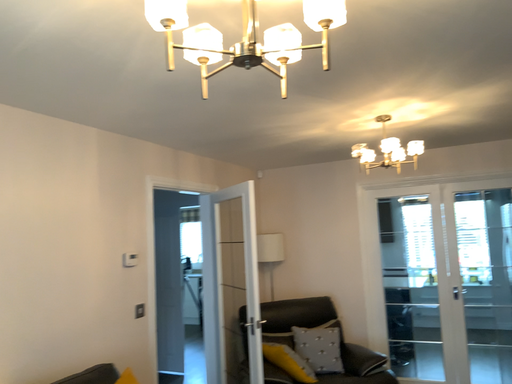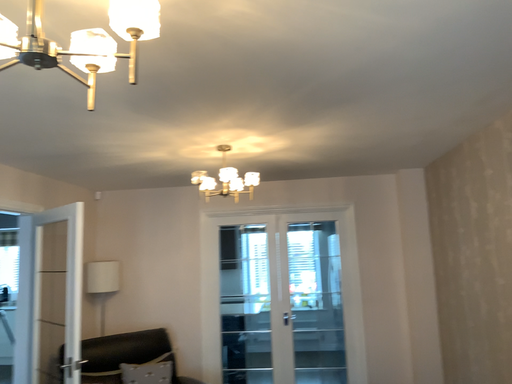
Question: Which way did the camera rotate in the video?

Choices:
 (A) rotated right
 (B) rotated left

Answer: (A)